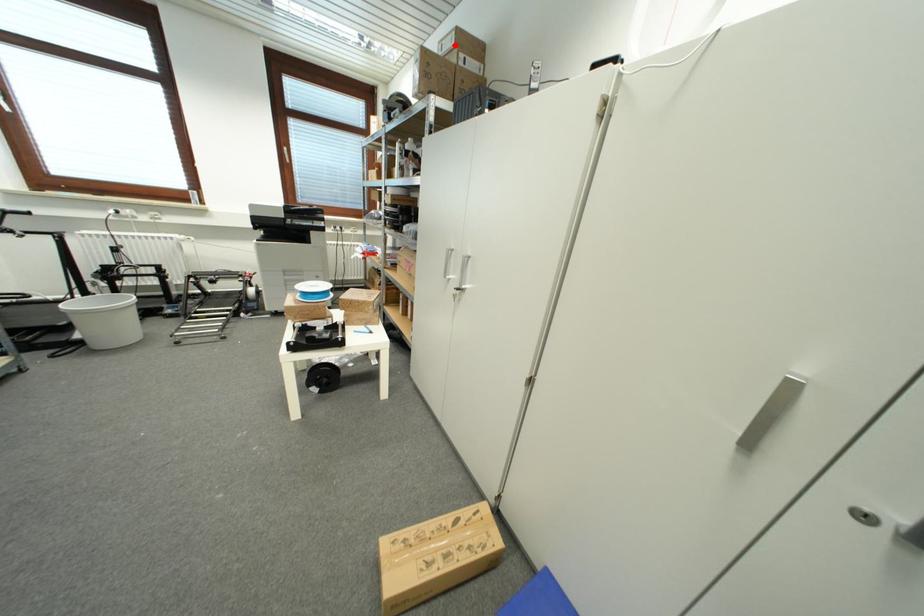
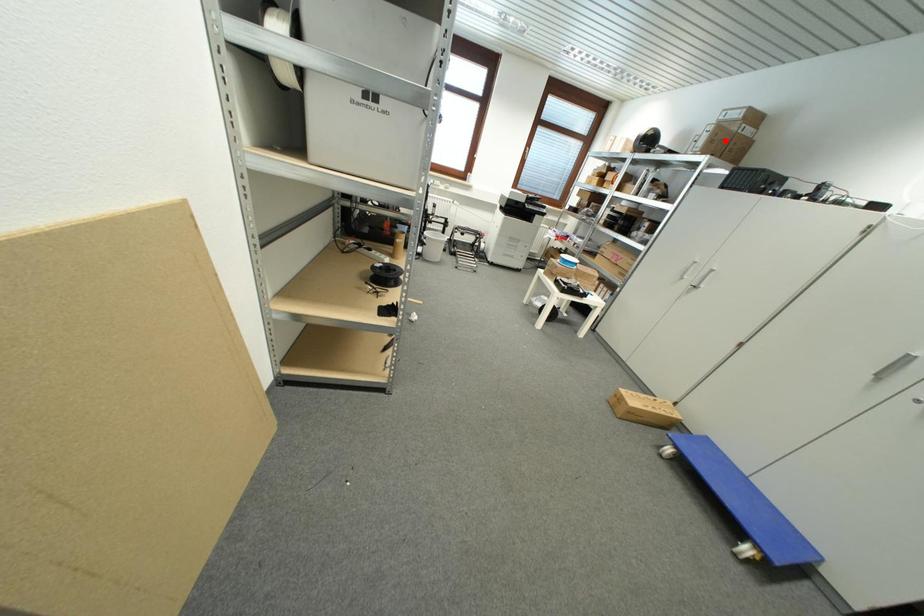
I am providing you with two images of the same scene from different viewpoints. A red point is marked on the first image and another point is marked on the second image. Does the point marked in image1 correspond to the same location as the one in image2?

No